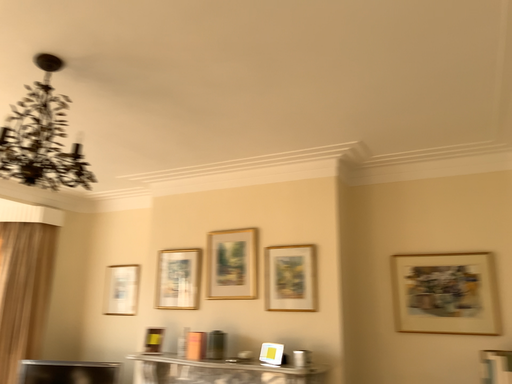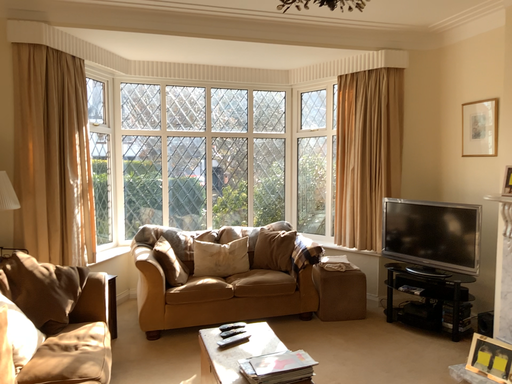
Question: How did the camera likely rotate when shooting the video?

Choices:
 (A) rotated downward
 (B) rotated upward

Answer: (A)